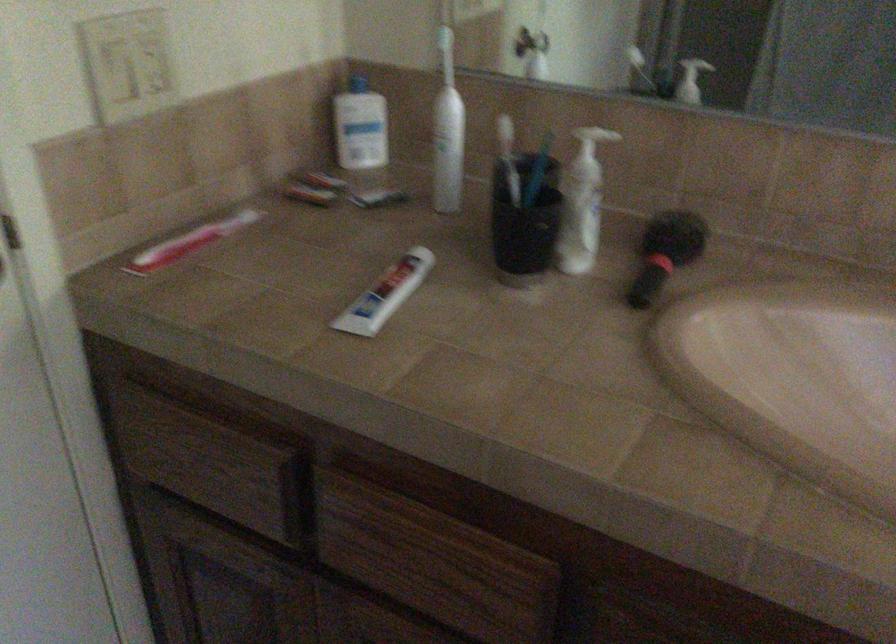
Locate an element on the screen. The height and width of the screenshot is (644, 896). black cup is located at coordinates (524, 222).